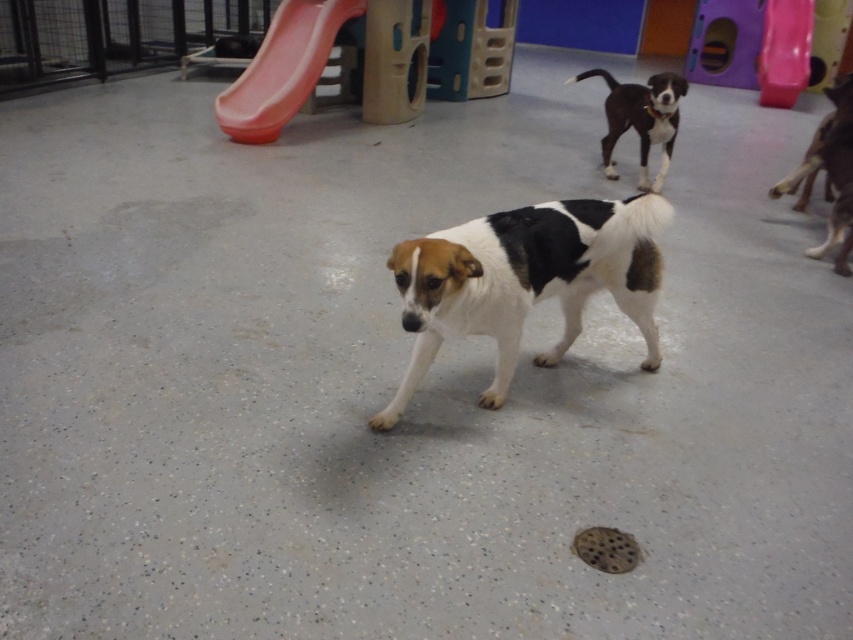
I want to click on black and white fur at upper right, so click(x=640, y=118).

At what (x,y) coordinates should I click in order to perform the action: click on black and white fur at upper right. Please return your answer as a coordinate pair (x, y). The height and width of the screenshot is (640, 853). Looking at the image, I should click on (640, 118).

Is rubber slide at upper center positioned in front of black and white fur at upper right?

No.

The height and width of the screenshot is (640, 853). What are the coordinates of `rubber slide at upper center` in the screenshot? It's located at (282, 68).

Find the location of a particular element. The height and width of the screenshot is (640, 853). rubber slide at upper center is located at coordinates (282, 68).

The image size is (853, 640). What are the coordinates of `rubber slide at upper center` in the screenshot? It's located at (282, 68).

Between point (251, 129) and point (834, 120), which one is positioned in front?

Positioned in front is point (834, 120).

Identify the location of rubber slide at upper center. (282, 68).